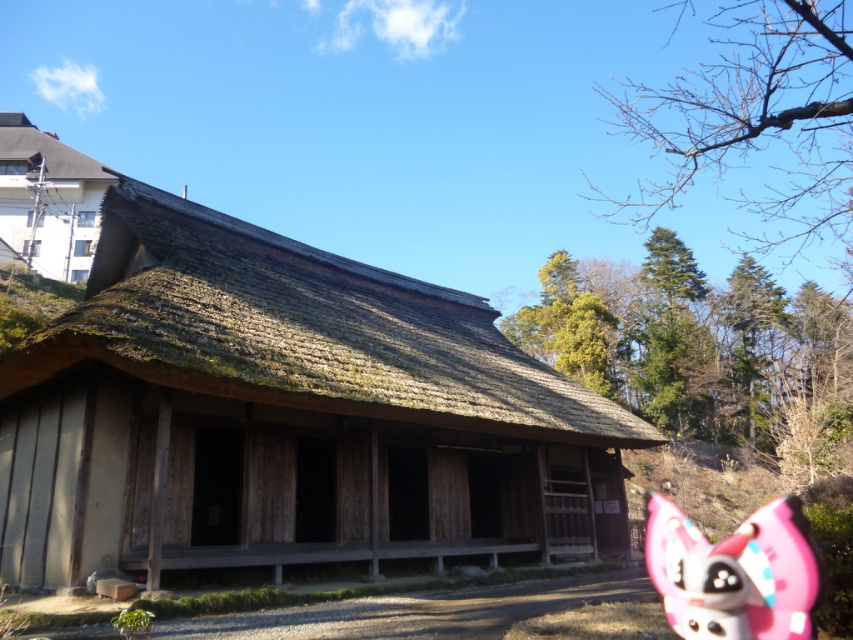
Question: Which point appears closest to the camera in this image?

Choices:
 (A) (520, 410)
 (B) (714, 632)

Answer: (B)

Question: Does wooden thatched hut at center lie in front of thatched wood hut at upper left?

Choices:
 (A) no
 (B) yes

Answer: (B)

Question: Is pink matte plush toy at lower right to the left of thatched wood hut at upper left from the viewer's perspective?

Choices:
 (A) no
 (B) yes

Answer: (A)

Question: Is pink matte plush toy at lower right to the left of thatched wood hut at upper left from the viewer's perspective?

Choices:
 (A) yes
 (B) no

Answer: (B)

Question: Considering the real-world distances, which object is farthest from the thatched wood hut at upper left?

Choices:
 (A) pink matte plush toy at lower right
 (B) wooden thatched hut at center

Answer: (A)

Question: Estimate the real-world distances between objects in this image. Which object is closer to the wooden thatched hut at center?

Choices:
 (A) thatched wood hut at upper left
 (B) pink matte plush toy at lower right

Answer: (B)